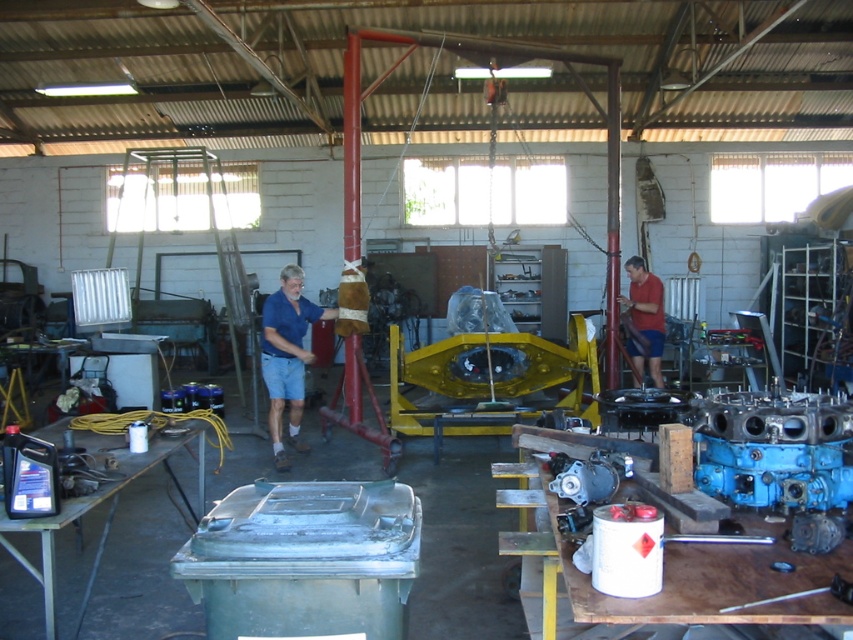
Can you confirm if black plastic workbench at lower left is taller than blue fabric shirt at center?

In fact, black plastic workbench at lower left may be shorter than blue fabric shirt at center.

This screenshot has width=853, height=640. I want to click on black plastic workbench at lower left, so click(100, 502).

Between point (103, 444) and point (299, 344), which one is positioned in front?

Point (103, 444) is more forward.

Find the location of a particular element. Image resolution: width=853 pixels, height=640 pixels. black plastic workbench at lower left is located at coordinates (100, 502).

Can you confirm if black plastic workbench at lower left is thinner than red matte shirt at center?

In fact, black plastic workbench at lower left might be wider than red matte shirt at center.

Looking at this image, can you confirm if black plastic workbench at lower left is wider than red matte shirt at center?

Yes.

Does point (49, 436) come behind point (663, 337)?

No, it is in front of (663, 337).

This screenshot has height=640, width=853. What are the coordinates of `black plastic workbench at lower left` in the screenshot? It's located at (100, 502).

Does blue fabric shirt at center lie in front of red matte shirt at center?

Yes, it is in front of red matte shirt at center.

Is point (274, 392) behind point (640, 346)?

No, it is in front of (640, 346).

Is point (296, 305) positioned behind point (650, 307)?

No.

Locate an element on the screen. This screenshot has height=640, width=853. blue fabric shirt at center is located at coordinates (287, 356).